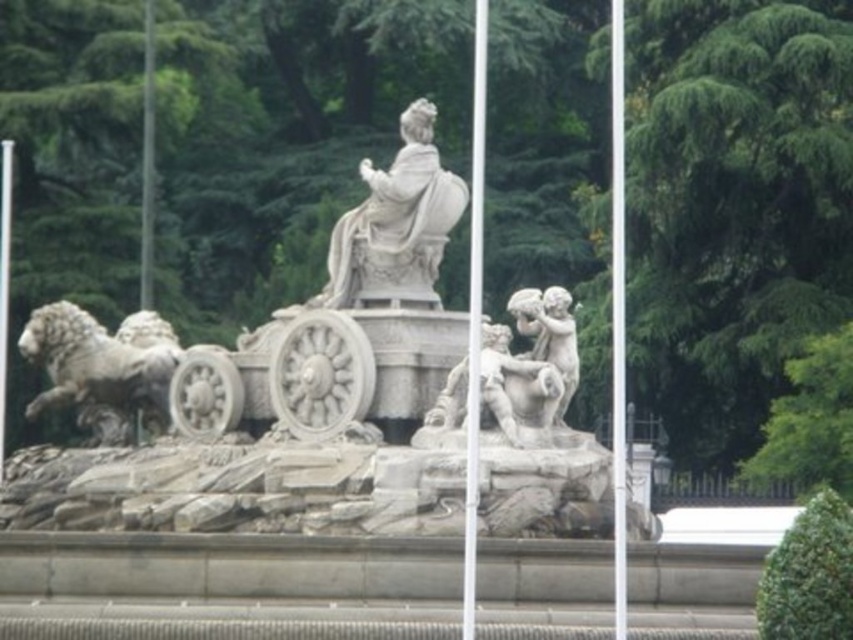
Which is below, gray stone lion at left or white marble statue at center?

gray stone lion at left is lower down.

Is point (39, 353) positioned behind point (379, 212)?

Yes.

The height and width of the screenshot is (640, 853). I want to click on gray stone lion at left, so click(102, 369).

Who is more forward, [625,596] or [469,538]?

Positioned in front is point [469,538].

The height and width of the screenshot is (640, 853). What do you see at coordinates (618, 321) in the screenshot?
I see `metallic flag pole at center` at bounding box center [618, 321].

Does point (624, 182) come closer to viewer compared to point (474, 13)?

Yes, point (624, 182) is closer to viewer.

The width and height of the screenshot is (853, 640). Find the location of `metallic flag pole at center`. metallic flag pole at center is located at coordinates (618, 321).

Does white stone fountain at center have a smaller size compared to metallic flag pole at center?

No, white stone fountain at center is not smaller than metallic flag pole at center.

Does white stone fountain at center have a lesser width compared to metallic flag pole at center?

In fact, white stone fountain at center might be wider than metallic flag pole at center.

Where is `white stone fountain at center`? white stone fountain at center is located at coordinates (276, 392).